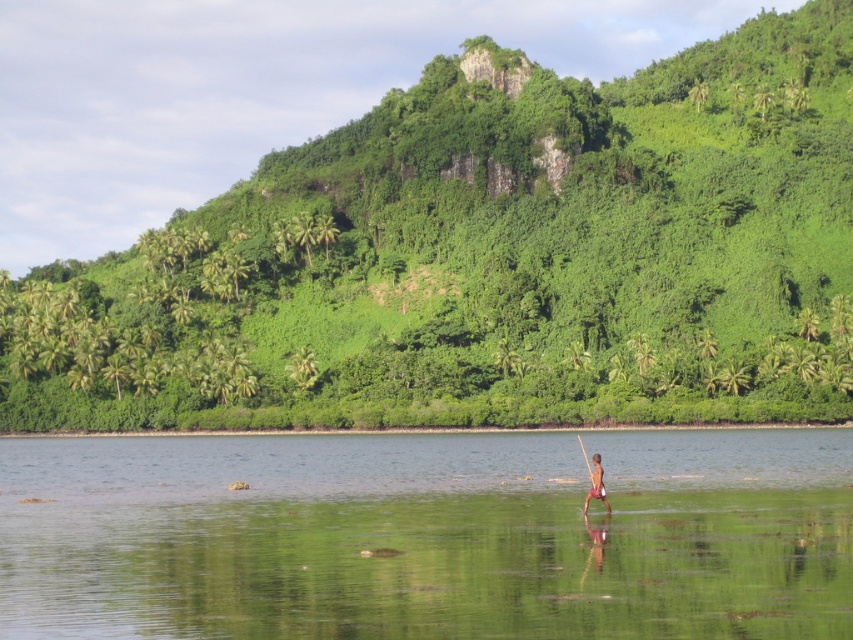
You are a photographer trying to capture a shot of the clear water at center and brown skin at center. Which object is positioned to the left of the other?

The clear water at center is to the left of brown skin at center.

You are a hiker who wants to cross from the green leafy hillside at upper center to the clear water at center. Given that the distance between them is 209.43 feet, can you estimate how long it would take you to walk this distance at a normal pace?

The distance between the green leafy hillside at upper center and the clear water at center is 209.43 feet. At a normal walking pace of about 3 feet per second, it would take approximately 69.8 seconds, or roughly 1 minute and 10 seconds, to cross the distance.